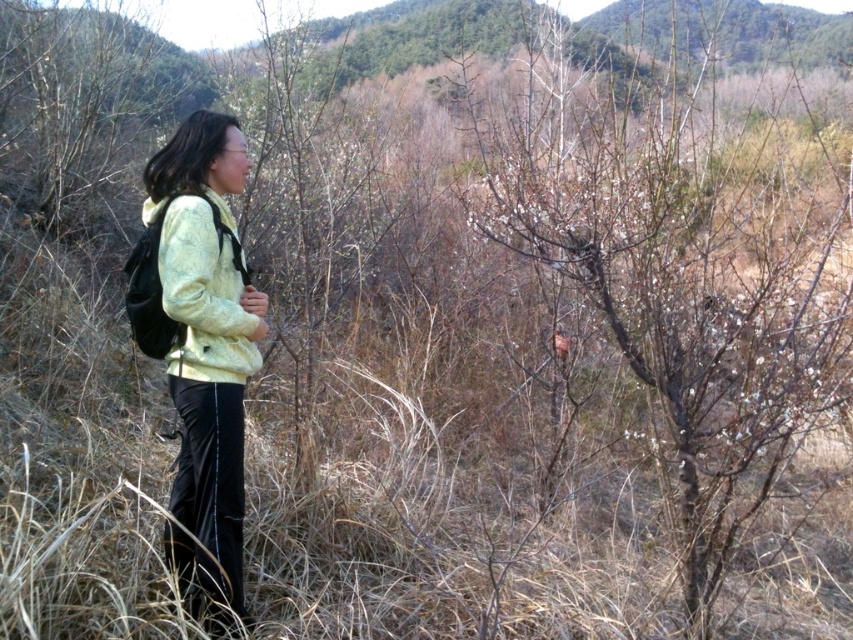
Consider the image. You are a hiker who wants to take a photo of the light yellow fleece at center without any obstruction. The bare branches at center are in the way. Can you move to your left or right to avoid them?

The bare branches at center might be wider than the light yellow fleece at center, so moving to either the left or right may not completely avoid the branches. Consider moving further back or adjusting the angle of your shot.

Where is the bare branches at center located in the image?

The bare branches at center is located at point (x=682, y=280) in the image.